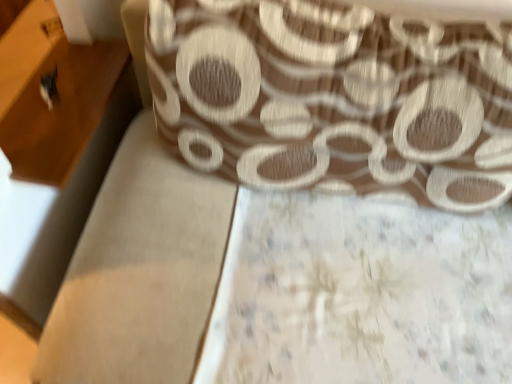
Question: From their relative heights in the image, would you say wooden drawer at left is taller or shorter than brown textured fabric at upper center?

Choices:
 (A) short
 (B) tall

Answer: (A)

Question: Based on their positions, is wooden drawer at left located to the left or right of brown textured fabric at upper center?

Choices:
 (A) left
 (B) right

Answer: (A)

Question: Looking at their shapes, would you say wooden drawer at left is wider or thinner than brown textured fabric at upper center?

Choices:
 (A) thin
 (B) wide

Answer: (A)

Question: In terms of height, does brown textured fabric at upper center look taller or shorter compared to wooden drawer at left?

Choices:
 (A) short
 (B) tall

Answer: (B)

Question: Is brown textured fabric at upper center situated inside wooden drawer at left or outside?

Choices:
 (A) inside
 (B) outside

Answer: (B)

Question: Based on their sizes in the image, would you say brown textured fabric at upper center is bigger or smaller than wooden drawer at left?

Choices:
 (A) big
 (B) small

Answer: (A)

Question: From the image's perspective, is brown textured fabric at upper center located above or below wooden drawer at left?

Choices:
 (A) below
 (B) above

Answer: (A)